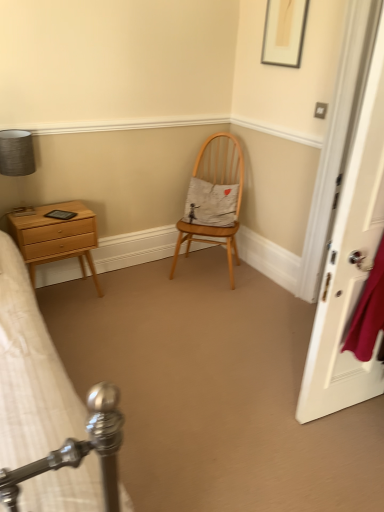
Find the location of a particular element. free area below matte gray lampshade at upper left (from a real-world perspective) is located at coordinates (21, 211).